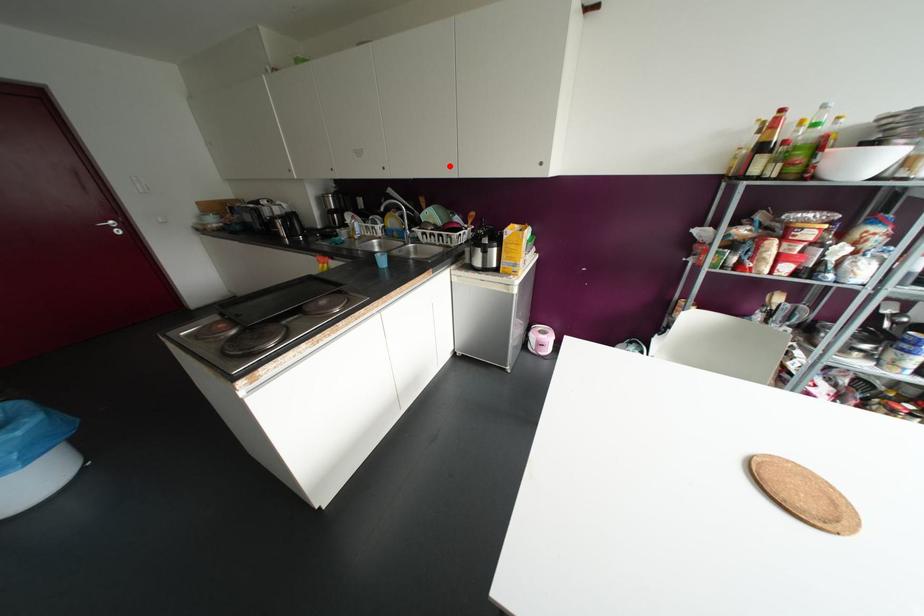
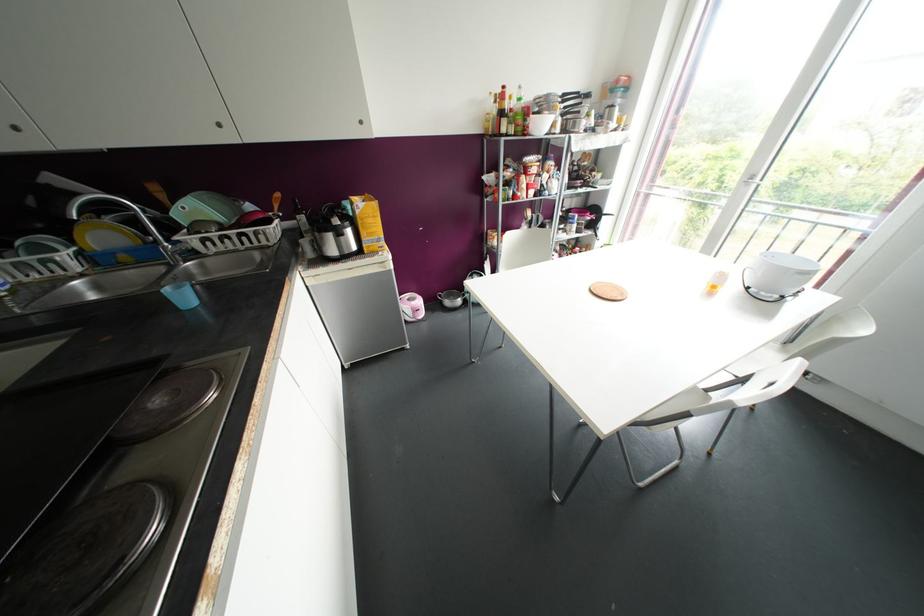
Locate, in the second image, the point that corresponds to the highlighted location in the first image.

(219, 124)